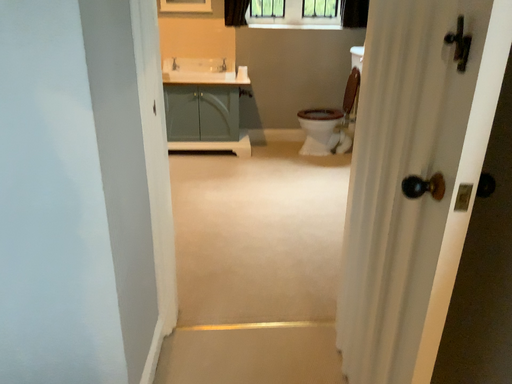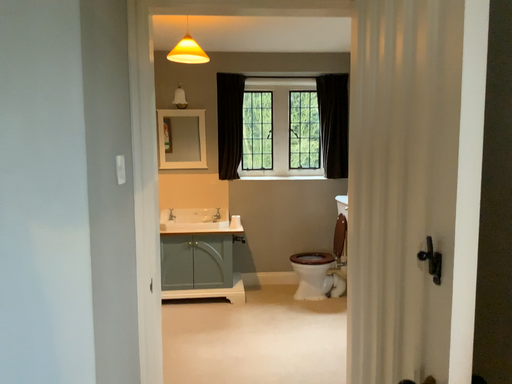
Question: How did the camera likely rotate when shooting the video?

Choices:
 (A) rotated upward
 (B) rotated downward

Answer: (A)